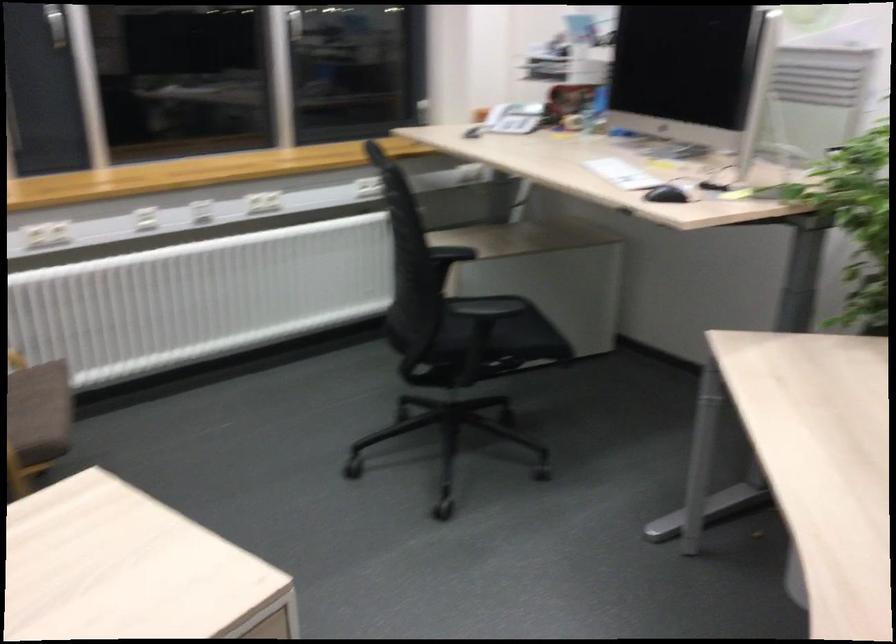
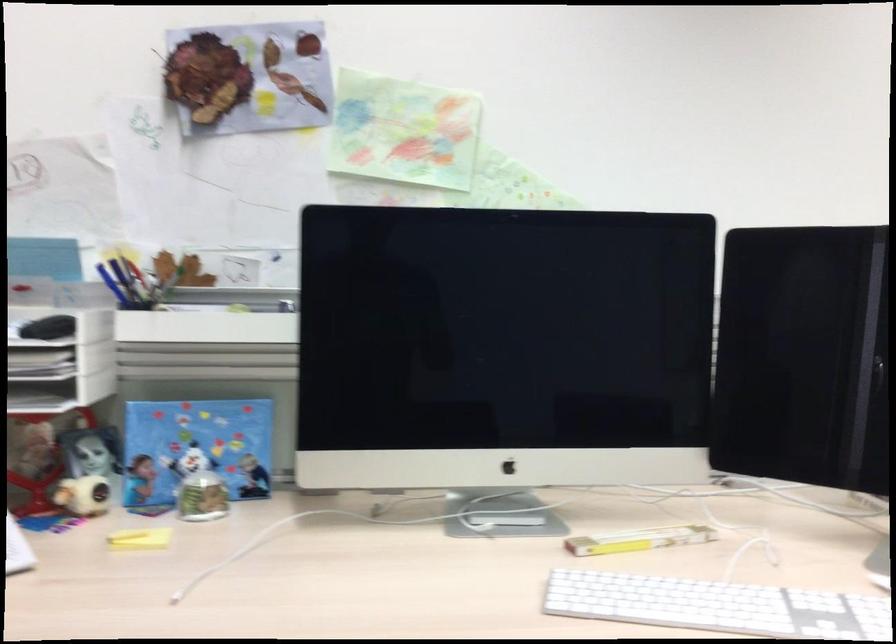
The point at (578,118) is marked in the first image. Where is the corresponding point in the second image?

(83, 495)